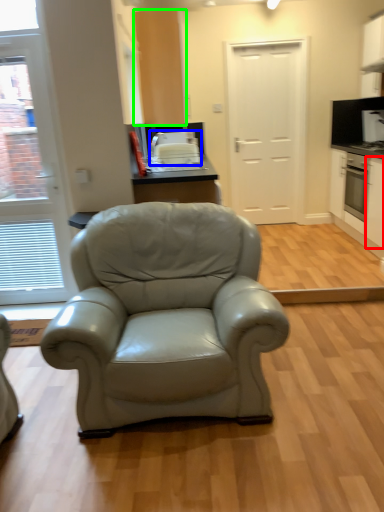
Question: Which object is the farthest from cabinetry (highlighted by a red box)? Choose among these: appliance (highlighted by a blue box) or cabinetry (highlighted by a green box).

Choices:
 (A) appliance
 (B) cabinetry

Answer: (B)